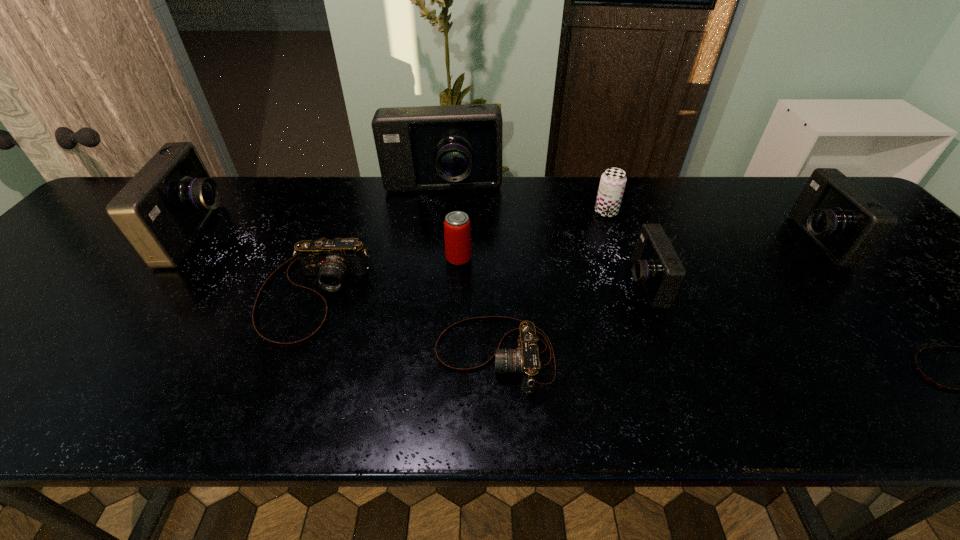
At what (x,y) coordinates should I click in order to perform the action: click on vacant space that's between the leftmost object and the third blue camera from left to right. Please return your answer as a coordinate pair (x, y). Looking at the image, I should click on (420, 259).

Identify the location of free space between the farther beer can and the fourth shortest camera. (625, 248).

Locate an element on the screen. Image resolution: width=960 pixels, height=540 pixels. free space between the second blue camera from right to left and the second smallest blue camera is located at coordinates (729, 262).

The height and width of the screenshot is (540, 960). What are the coordinates of `vacant area that lies between the second shortest camera and the second blue camera from right to left` in the screenshot? It's located at (569, 320).

The width and height of the screenshot is (960, 540). I want to click on object that is the fifth closest one to the third shortest object, so click(612, 184).

Identify which object is the seventh closest to the smallest brown camera. Please provide its 2D coordinates. Your answer should be formatted as a tuple, i.e. [(x, y)], where the tuple contains the x and y coordinates of a point satisfying the conditions above.

[(331, 261)]

Image resolution: width=960 pixels, height=540 pixels. Find the location of `camera that is the sixth closest to the farther beer can`. camera that is the sixth closest to the farther beer can is located at coordinates (917, 368).

Locate an element on the screen. the fifth closest camera relative to the third smallest blue camera is located at coordinates (845, 222).

Image resolution: width=960 pixels, height=540 pixels. I want to click on blue camera that is the closest to the second smallest brown camera, so click(656, 265).

In order to click on blue camera identified as the second closest to the rightmost blue camera in this screenshot , I will do `click(450, 147)`.